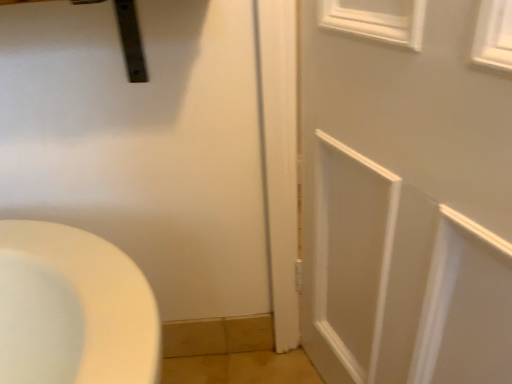
The image size is (512, 384). What do you see at coordinates (406, 190) in the screenshot?
I see `white painted wood door at center` at bounding box center [406, 190].

What are the coordinates of `white painted wood door at center` in the screenshot? It's located at (406, 190).

Locate an element on the screen. white painted wood door at center is located at coordinates (406, 190).